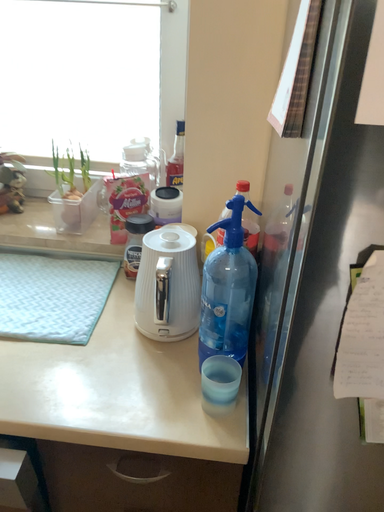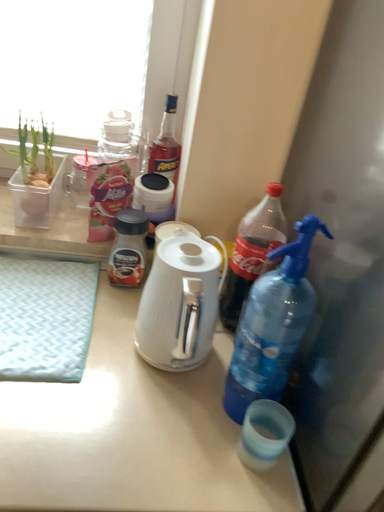
Question: How did the camera likely rotate when shooting the video?

Choices:
 (A) rotated right
 (B) rotated left

Answer: (A)